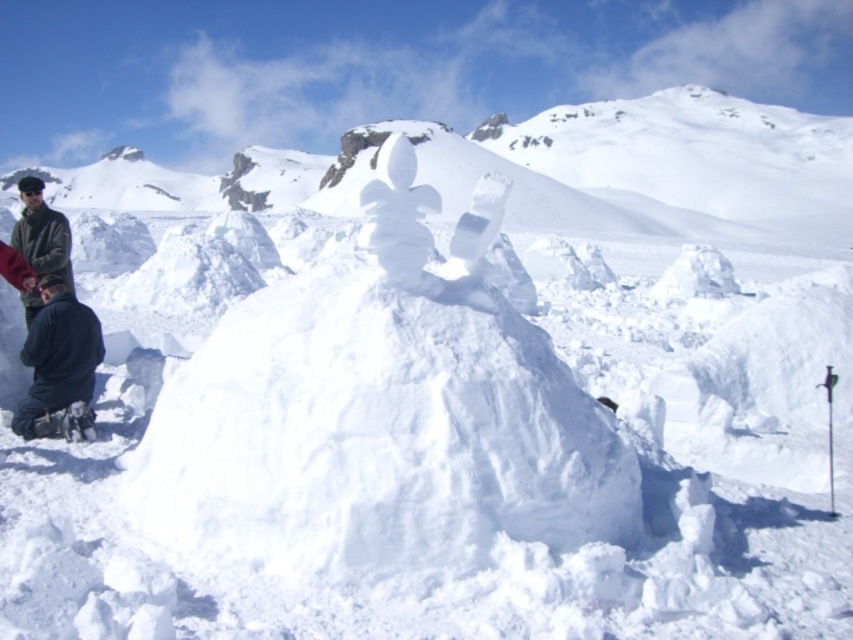
Does dark blue fleece at lower left appear over dark gray jacket at left?

No.

Can you confirm if dark blue fleece at lower left is positioned to the right of dark gray jacket at left?

Correct, you'll find dark blue fleece at lower left to the right of dark gray jacket at left.

Who is more distant from viewer, (61,387) or (26,298)?

The point (26,298) is behind.

Where is `dark blue fleece at lower left`? This screenshot has height=640, width=853. dark blue fleece at lower left is located at coordinates coord(57,356).

Consider the image. Who is positioned more to the left, white fluffy snowman at center or dark gray jacket at left?

dark gray jacket at left is more to the left.

In the scene shown: Can you confirm if white fluffy snowman at center is positioned below dark gray jacket at left?

Correct, white fluffy snowman at center is located below dark gray jacket at left.

Find the location of a particular element. The image size is (853, 640). white fluffy snowman at center is located at coordinates (398, 218).

Does dark blue fleece at lower left have a greater width compared to white fluffy snowman at center?

Indeed, dark blue fleece at lower left has a greater width compared to white fluffy snowman at center.

Who is positioned more to the left, dark blue fleece at lower left or white fluffy snowman at center?

Positioned to the left is dark blue fleece at lower left.

What are the coordinates of `dark blue fleece at lower left` in the screenshot? It's located at (57, 356).